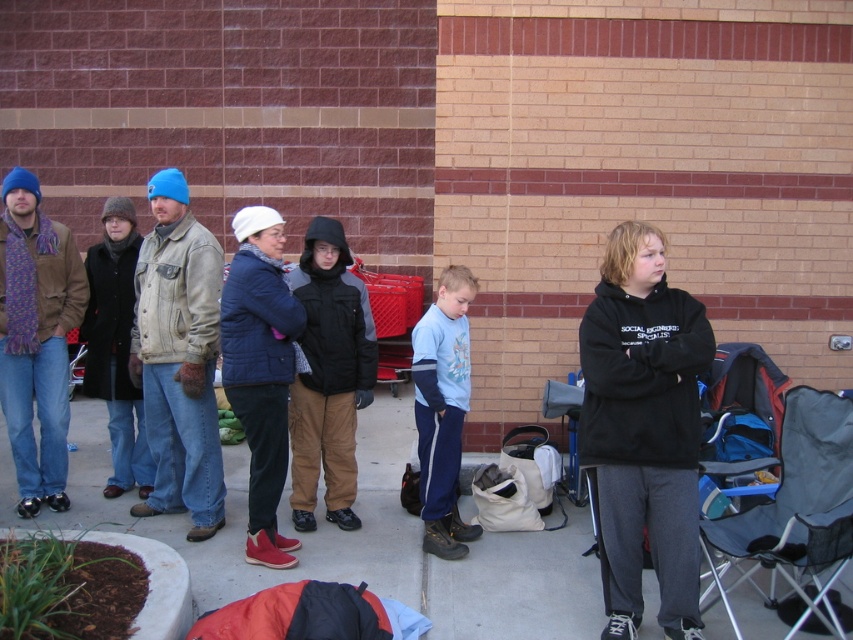
Does concrete pavement at center have a greater width compared to black fabric folding chair at lower right?

Yes, concrete pavement at center is wider than black fabric folding chair at lower right.

Does concrete pavement at center have a smaller size compared to black fabric folding chair at lower right?

Incorrect, concrete pavement at center is not smaller in size than black fabric folding chair at lower right.

Between point (300, 576) and point (798, 451), which one is positioned behind?

Positioned behind is point (300, 576).

You are a GUI agent. You are given a task and a screenshot of the screen. Output one action in this format:
    pyautogui.click(x=<x>, y=<y>)
    Task: Click on the concrete pavement at center
    
    Given the screenshot: What is the action you would take?
    pyautogui.click(x=367, y=541)

Can you confirm if concrete pavement at center is thinner than blue fleece sweatshirt at center?

In fact, concrete pavement at center might be wider than blue fleece sweatshirt at center.

Is point (404, 444) farther from viewer compared to point (437, 509)?

Yes.

Does point (4, 518) come behind point (440, 369)?

Yes, point (4, 518) is behind point (440, 369).

Locate an element on the screen. concrete pavement at center is located at coordinates (367, 541).

Between black fabric folding chair at lower right and blue fleece sweatshirt at center, which one is positioned higher?

Positioned higher is blue fleece sweatshirt at center.

Between point (828, 604) and point (456, 324), which one is positioned behind?

Positioned behind is point (456, 324).

Who is more forward, (798, 531) or (456, 509)?

Point (798, 531)

This screenshot has width=853, height=640. In order to click on black fabric folding chair at lower right in this screenshot , I will do `click(795, 509)`.